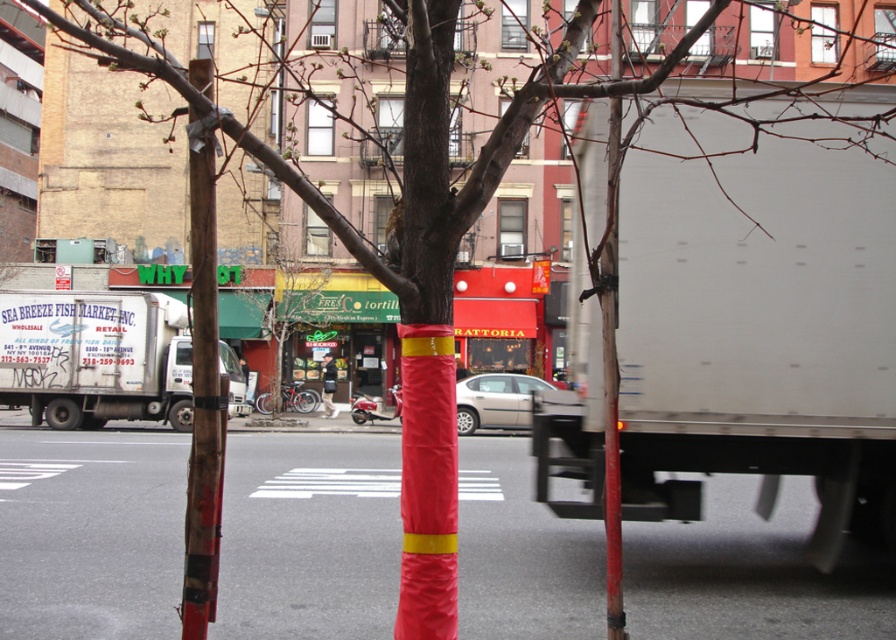
You are a delivery person who needs to park your vehicle between the white matte truck at right and the red plastic pole at center. Given that the space between them is narrow, can you safely maneuver your car into this spot?

The white matte truck at right is positioned on the right side of the red plastic pole at center, so there is space between them. However, the description does not provide specific measurements of the distance between the two objects. Without knowing the exact width of your vehicle or the available space, it is impossible to determine if it is safe to maneuver into this spot.

You are a pedestrian standing on the sidewalk and want to walk towards the green plastic tree at center. Is the white metallic truck at left blocking your path?

The white metallic truck at left is in front of the green plastic tree at center, so it is blocking your path.

You are a city planner assessing the street layout. The wooden pole at center and the green plastic tree at center are both in the same area. Which object has a smaller diameter?

The wooden pole at center is thinner than the green plastic tree at center, so the wooden pole at center has a smaller diameter.